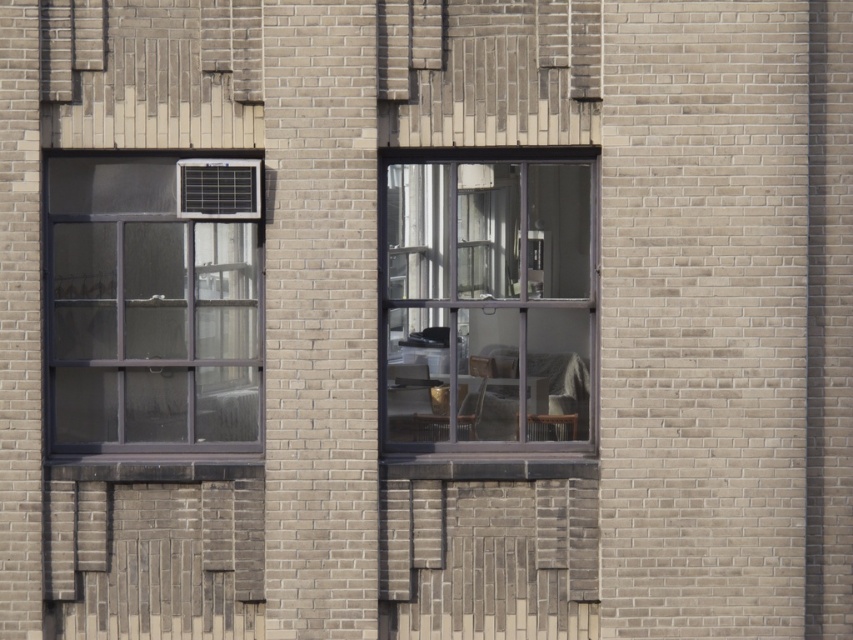
You are a window installer who needs to replace the glass in both the clear glass window at left and the clear glass window at center. Based on their positions, which window should you work on first to avoid getting in the way of the other worker below you?

The clear glass window at left is located above the clear glass window at center. Therefore, you should work on the clear glass window at left first to avoid dropping debris onto the worker below who is working on the clear glass window at center.

You are an architect designing a new building and want to ensure proper spacing between the clear glass window at left and the clear glass window at center. Given their sizes, which window should be placed farther apart from the other to maintain structural integrity?

The clear glass window at left is wider than the clear glass window at center, so to maintain structural integrity, the clear glass window at left should be placed farther apart from the other window.